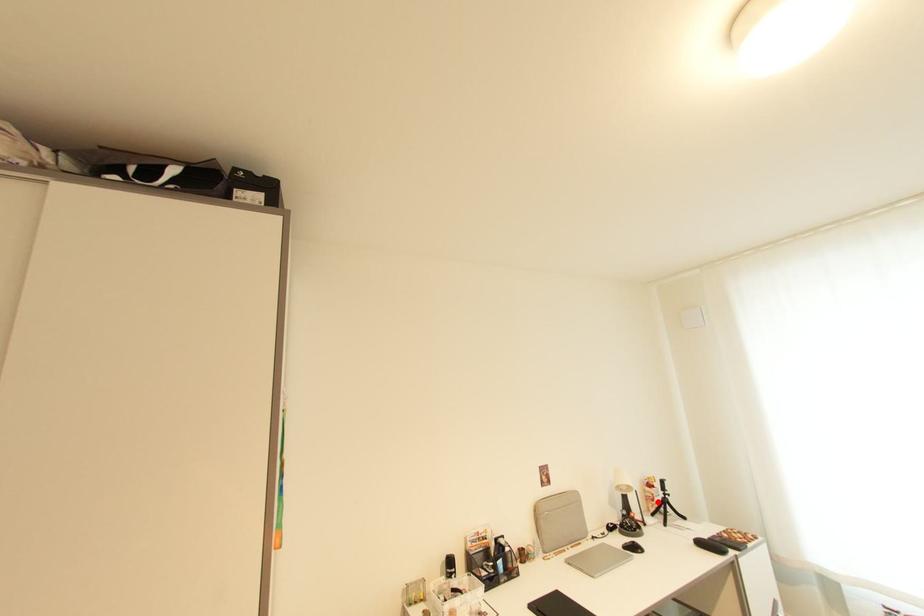
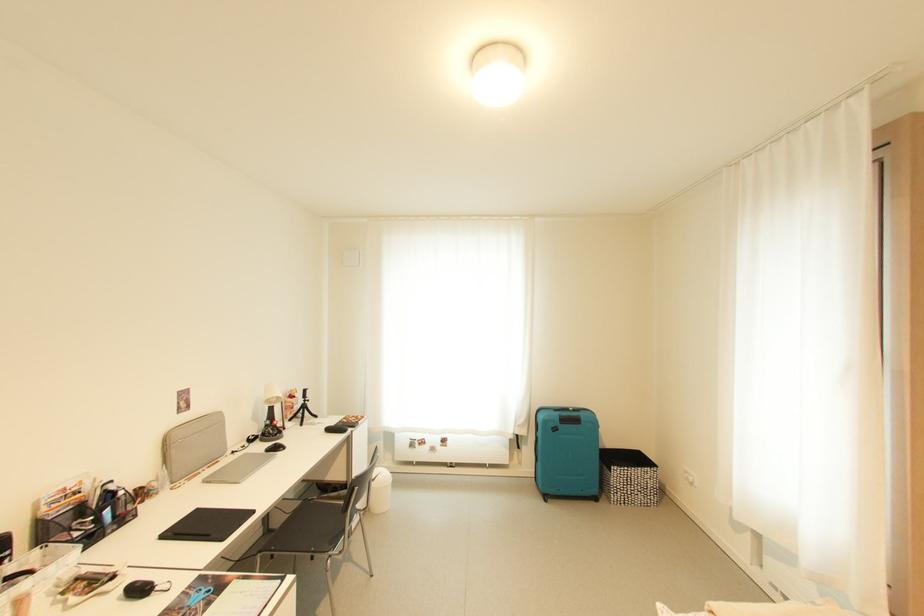
Find the pixel in the second image that matches the highlighted location in the first image.

(297, 410)